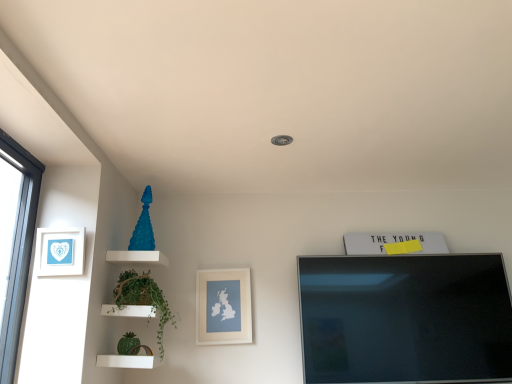
Describe the element at coordinates (223, 306) in the screenshot. I see `matte white picture frame at center, which is the first picture frame in bottom-to-top order` at that location.

What are the coordinates of `green leafy plant at left` in the screenshot? It's located at (144, 299).

Does green leafy plant at left touch white paper at left, which is the first picture frame in top-to-bottom order?

green leafy plant at left and white paper at left, which is the first picture frame in top-to-bottom order, are clearly separated.

From a real-world perspective, is green leafy plant at left positioned over white paper at left, which ranks as the second picture frame in bottom-to-top order, based on gravity?

No, from a real-world perspective, green leafy plant at left is not on top of white paper at left, which ranks as the second picture frame in bottom-to-top order.

Between green leafy plant at left and white paper at left, which is the first picture frame from front to back, which one has larger width?

Wider between the two is green leafy plant at left.

Is matte white picture frame at center, acting as the 2th picture frame starting from the top, inside the boundaries of green leafy plant at left, or outside?

matte white picture frame at center, acting as the 2th picture frame starting from the top, is outside green leafy plant at left.

Is matte white picture frame at center, the 2th picture frame from the front, facing away from green leafy plant at left?

No, green leafy plant at left is not at the back of matte white picture frame at center, the 2th picture frame from the front.

Is matte white picture frame at center, acting as the 2th picture frame starting from the top, to the left of green leafy plant at left from the viewer's perspective?

Incorrect, matte white picture frame at center, acting as the 2th picture frame starting from the top, is not on the left side of green leafy plant at left.

Identify the location of picture frame on the right of green leafy plant at left. (223, 306).

Considering the relative sizes of matte white picture frame at center, arranged as the first picture frame when viewed from the right, and white paper at left, the 2th picture frame in the right-to-left sequence, in the image provided, is matte white picture frame at center, arranged as the first picture frame when viewed from the right, wider than white paper at left, the 2th picture frame in the right-to-left sequence,?

No, matte white picture frame at center, arranged as the first picture frame when viewed from the right, is not wider than white paper at left, the 2th picture frame in the right-to-left sequence.

Is matte white picture frame at center, the 2th picture frame from the front, facing away from white paper at left, which ranks as the second picture frame in bottom-to-top order?

That's not correct — matte white picture frame at center, the 2th picture frame from the front, is not looking away from white paper at left, which ranks as the second picture frame in bottom-to-top order.

From the image's perspective, is matte white picture frame at center, which appears as the second picture frame when viewed from the left, located above or below white paper at left, acting as the first picture frame starting from the left?

Clearly, from the image's perspective, matte white picture frame at center, which appears as the second picture frame when viewed from the left, is below white paper at left, acting as the first picture frame starting from the left.

From a real-world perspective, is matte white picture frame at center, which appears as the second picture frame when viewed from the left, below white paper at left, the 2th picture frame in the right-to-left sequence?

Correct, in the physical world, matte white picture frame at center, which appears as the second picture frame when viewed from the left, is lower than white paper at left, the 2th picture frame in the right-to-left sequence.

Is white paper at left, which is the first picture frame in top-to-bottom order, far away from matte white picture frame at center, arranged as the first picture frame when viewed from the right?

Actually, white paper at left, which is the first picture frame in top-to-bottom order, and matte white picture frame at center, arranged as the first picture frame when viewed from the right, are a little close together.

How different are the orientations of white paper at left, which ranks as the second picture frame in bottom-to-top order, and matte white picture frame at center, acting as the 2th picture frame starting from the top, in degrees?

The facing directions of white paper at left, which ranks as the second picture frame in bottom-to-top order, and matte white picture frame at center, acting as the 2th picture frame starting from the top, are 0.104 degrees apart.

From a real-world perspective, is white paper at left, acting as the first picture frame starting from the left, positioned above or below matte white picture frame at center, which appears as the second picture frame when viewed from the left?

Clearly, from a real-world perspective, white paper at left, acting as the first picture frame starting from the left, is above matte white picture frame at center, which appears as the second picture frame when viewed from the left.

Does white paper at left, which is the first picture frame in top-to-bottom order, have a smaller size compared to matte white picture frame at center, which appears as the second picture frame when viewed from the left?

Yes.

Locate an element on the screen. This screenshot has height=384, width=512. plant below the white paper at left, the 2th picture frame in the right-to-left sequence (from the image's perspective) is located at coordinates 144,299.

Is point (62, 274) closer to camera compared to point (133, 275)?

That is True.

Would you consider white paper at left, marked as the 2th picture frame in a back-to-front arrangement, to be distant from green leafy plant at left?

white paper at left, marked as the 2th picture frame in a back-to-front arrangement, is actually quite close to green leafy plant at left.

Can you tell me how much white paper at left, which ranks as the second picture frame in bottom-to-top order, and green leafy plant at left differ in facing direction?

89.6 degrees separate the facing orientations of white paper at left, which ranks as the second picture frame in bottom-to-top order, and green leafy plant at left.

Which object is wider, green leafy plant at left or matte white picture frame at center, which appears as the second picture frame when viewed from the left?

With larger width is green leafy plant at left.

Could you tell me if green leafy plant at left is turned towards matte white picture frame at center, the 1th picture frame in the back-to-front sequence?

No, green leafy plant at left is not turned towards matte white picture frame at center, the 1th picture frame in the back-to-front sequence.

Considering the relative sizes of green leafy plant at left and matte white picture frame at center, arranged as the first picture frame when viewed from the right, in the image provided, is green leafy plant at left shorter than matte white picture frame at center, arranged as the first picture frame when viewed from the right,?

Incorrect, the height of green leafy plant at left does not fall short of that of matte white picture frame at center, arranged as the first picture frame when viewed from the right.

This screenshot has width=512, height=384. In the image, there is a white paper at left, which is the first picture frame from front to back. What are the coordinates of `plant below it (from the image's perspective)` in the screenshot? It's located at (144, 299).

The height and width of the screenshot is (384, 512). I want to click on picture frame that is the 1st one above the green leafy plant at left (from a real-world perspective), so 223,306.

Estimate the real-world distances between objects in this image. Which object is further from white paper at left, which is the first picture frame in top-to-bottom order, green leafy plant at left or matte white picture frame at center, arranged as the first picture frame when viewed from the right?

matte white picture frame at center, arranged as the first picture frame when viewed from the right.

Estimate the real-world distances between objects in this image. Which object is closer to green leafy plant at left, white paper at left, marked as the 2th picture frame in a back-to-front arrangement, or matte white picture frame at center, acting as the 2th picture frame starting from the top?

white paper at left, marked as the 2th picture frame in a back-to-front arrangement, is closer to green leafy plant at left.

Which object lies nearer to the anchor point green leafy plant at left, matte white picture frame at center, arranged as the first picture frame when viewed from the right, or white paper at left, marked as the 2th picture frame in a back-to-front arrangement?

white paper at left, marked as the 2th picture frame in a back-to-front arrangement, is closer to green leafy plant at left.

From the image, which object appears to be farther from matte white picture frame at center, which appears as the second picture frame when viewed from the left, green leafy plant at left or white paper at left, which is the first picture frame from front to back?

white paper at left, which is the first picture frame from front to back, lies further to matte white picture frame at center, which appears as the second picture frame when viewed from the left, than the other object.

Based on their spatial positions, is white paper at left, which ranks as the second picture frame in bottom-to-top order, or green leafy plant at left closer to matte white picture frame at center, which appears as the second picture frame when viewed from the left?

green leafy plant at left.

Considering their positions, is matte white picture frame at center, the 1th picture frame in the back-to-front sequence, positioned further to white paper at left, acting as the first picture frame starting from the left, than green leafy plant at left?

Based on the image, matte white picture frame at center, the 1th picture frame in the back-to-front sequence, appears to be further to white paper at left, acting as the first picture frame starting from the left.

This screenshot has width=512, height=384. Identify the location of plant located between white paper at left, which is the first picture frame in top-to-bottom order, and matte white picture frame at center, the 2th picture frame from the front, in the left-right direction. (144, 299).